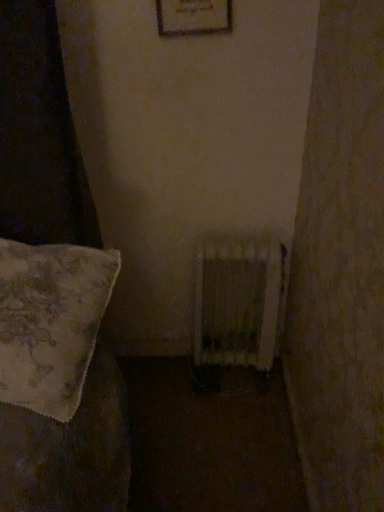
Question: Does floral fabric pillow at left appear on the left side of wooden radiator at center?

Choices:
 (A) yes
 (B) no

Answer: (A)

Question: From the image's perspective, is floral fabric pillow at left above wooden radiator at center?

Choices:
 (A) yes
 (B) no

Answer: (A)

Question: Is floral fabric pillow at left positioned with its back to wooden radiator at center?

Choices:
 (A) no
 (B) yes

Answer: (A)

Question: Are floral fabric pillow at left and wooden radiator at center located far from each other?

Choices:
 (A) no
 (B) yes

Answer: (A)

Question: Is floral fabric pillow at left to the right of wooden radiator at center from the viewer's perspective?

Choices:
 (A) yes
 (B) no

Answer: (B)

Question: From a real-world perspective, does floral fabric pillow at left stand above wooden radiator at center?

Choices:
 (A) yes
 (B) no

Answer: (A)

Question: Considering the relative sizes of wooden radiator at center and wooden framed picture at upper center in the image provided, is wooden radiator at center smaller than wooden framed picture at upper center?

Choices:
 (A) yes
 (B) no

Answer: (B)

Question: From the image's perspective, is wooden radiator at center located above wooden framed picture at upper center?

Choices:
 (A) no
 (B) yes

Answer: (A)

Question: Is wooden radiator at center further to the viewer compared to wooden framed picture at upper center?

Choices:
 (A) no
 (B) yes

Answer: (B)

Question: Is wooden radiator at center far away from wooden framed picture at upper center?

Choices:
 (A) no
 (B) yes

Answer: (A)

Question: Considering the relative sizes of wooden radiator at center and wooden framed picture at upper center in the image provided, is wooden radiator at center shorter than wooden framed picture at upper center?

Choices:
 (A) yes
 (B) no

Answer: (B)

Question: Does wooden radiator at center have a greater width compared to wooden framed picture at upper center?

Choices:
 (A) yes
 (B) no

Answer: (A)

Question: Is wooden framed picture at upper center surrounding floral fabric pillow at left?

Choices:
 (A) no
 (B) yes

Answer: (A)